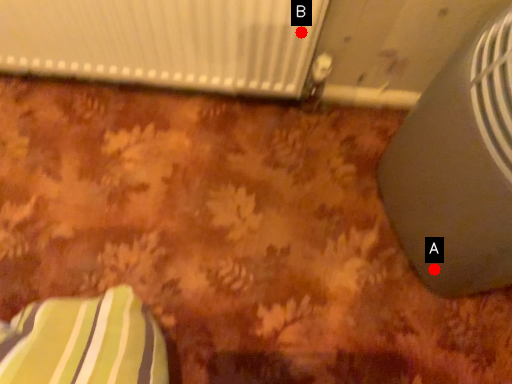
Question: Two points are circled on the image, labeled by A and B beside each circle. Among these points, which one is farthest from the camera?

Choices:
 (A) A is further
 (B) B is further

Answer: (A)